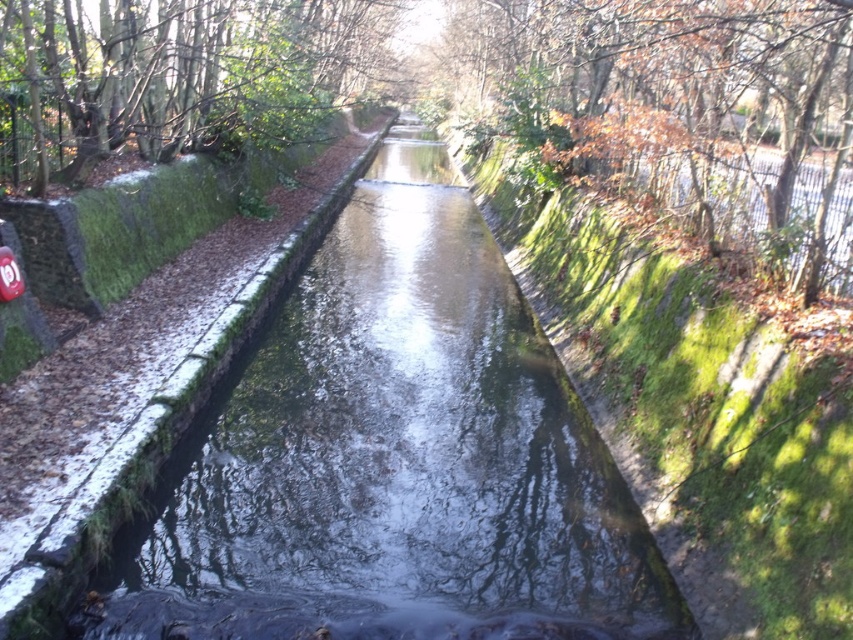
Is point (430, 236) positioned after point (811, 253)?

Yes, it is behind point (811, 253).

How distant is green mossy stream at center from brown leafy tree at upper right?

The distance of green mossy stream at center from brown leafy tree at upper right is 5.35 meters.

Find the location of `green mossy stream at center`. green mossy stream at center is located at coordinates (392, 460).

From the picture: Who is more forward, [622,97] or [108,61]?

Point [108,61] is more forward.

Consider the image. Is brown leafy tree at upper right smaller than green mossy tree at upper left?

Yes.

Which is behind, point (585, 168) or point (15, 83)?

The point (585, 168) is more distant.

Identify the location of brown leafy tree at upper right. This screenshot has height=640, width=853. (683, 108).

Is green mossy stream at center positioned behind green mossy tree at upper left?

No, green mossy stream at center is closer to the viewer.

The height and width of the screenshot is (640, 853). What do you see at coordinates (392, 460) in the screenshot? I see `green mossy stream at center` at bounding box center [392, 460].

Image resolution: width=853 pixels, height=640 pixels. Identify the location of green mossy stream at center. (392, 460).

The image size is (853, 640). In order to click on green mossy stream at center in this screenshot , I will do `click(392, 460)`.